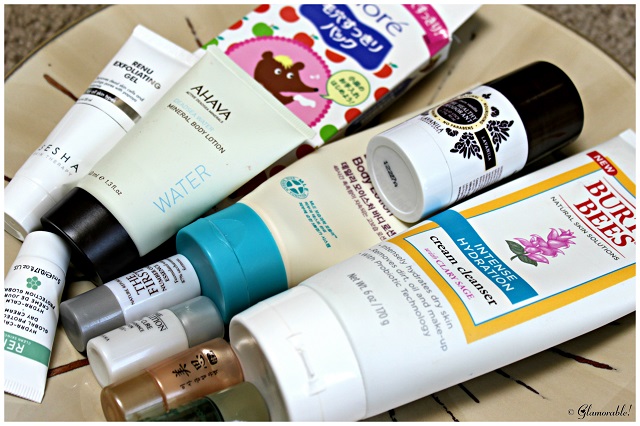
I want to click on pull here to open the center where the lotion comes out, so click(223, 235).